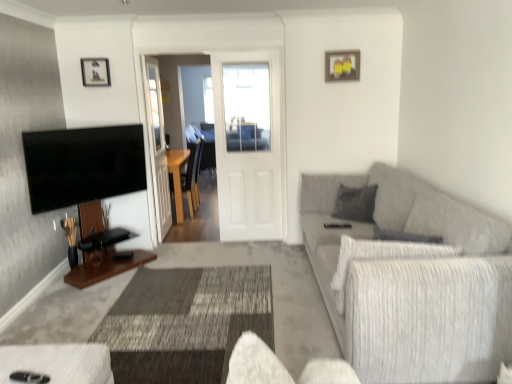
Question: From the image's perspective, is wooden picture frame at upper center, the 1th picture frame from the left, positioned above or below textured gray couch at right?

Choices:
 (A) above
 (B) below

Answer: (A)

Question: Considering the positions of wooden picture frame at upper center, the 1th picture frame from the left, and textured gray couch at right in the image, is wooden picture frame at upper center, the 1th picture frame from the left, wider or thinner than textured gray couch at right?

Choices:
 (A) thin
 (B) wide

Answer: (A)

Question: Which object is the closest to the wooden picture frame at upper center, the 1th picture frame from the left?

Choices:
 (A) textured gray couch at right
 (B) wooden picture frame at upper center, the 2th picture frame viewed from the left
 (C) black glossy flat-screen tv at left
 (D) white matte door at center
 (E) wooden table at center

Answer: (C)

Question: Based on their relative distances, which object is farther from the wooden picture frame at upper center, the 1th picture frame from the left?

Choices:
 (A) white matte door at center
 (B) wooden table at center
 (C) transparent glass door at center
 (D) wooden picture frame at upper center, the first picture frame positioned from the right
 (E) black glossy flat-screen tv at left

Answer: (D)